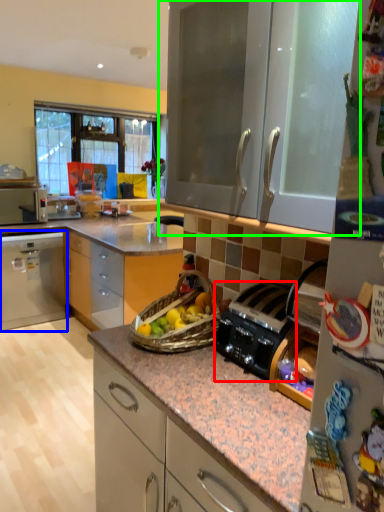
Question: Estimate the real-world distances between objects in this image. Which object is closer to kitchen appliance (highlighted by a red box), cabinetry (highlighted by a blue box) or cabinetry (highlighted by a green box)?

Choices:
 (A) cabinetry
 (B) cabinetry

Answer: (B)